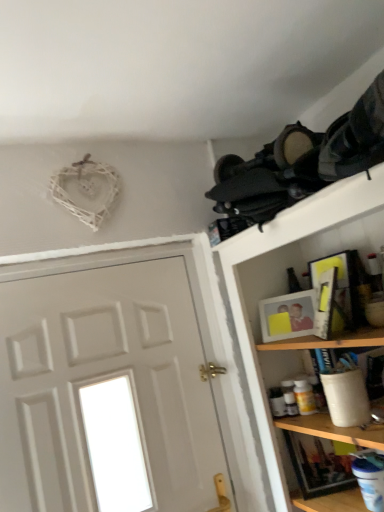
Question: Considering the relative positions of matte yellow picture frame at upper right, the 2th picture frame when ordered from back to front, and wooden shelf at upper right in the image provided, is matte yellow picture frame at upper right, the 2th picture frame when ordered from back to front, to the left of wooden shelf at upper right from the viewer's perspective?

Choices:
 (A) yes
 (B) no

Answer: (A)

Question: Is matte yellow picture frame at upper right, which appears as the 1th picture frame when viewed from the front, wider than wooden shelf at upper right?

Choices:
 (A) yes
 (B) no

Answer: (B)

Question: From the image's perspective, is matte yellow picture frame at upper right, which appears as the 1th picture frame when viewed from the front, over wooden shelf at upper right?

Choices:
 (A) no
 (B) yes

Answer: (B)

Question: Considering the relative sizes of matte yellow picture frame at upper right, which appears as the 1th picture frame when viewed from the front, and wooden shelf at upper right in the image provided, is matte yellow picture frame at upper right, which appears as the 1th picture frame when viewed from the front, bigger than wooden shelf at upper right?

Choices:
 (A) no
 (B) yes

Answer: (A)

Question: From their relative heights in the image, would you say white painted wood door at left is taller or shorter than black fabric backpacks at upper right?

Choices:
 (A) tall
 (B) short

Answer: (A)

Question: Based on their sizes in the image, would you say white painted wood door at left is bigger or smaller than black fabric backpacks at upper right?

Choices:
 (A) big
 (B) small

Answer: (A)

Question: Choose the correct answer: Is white painted wood door at left inside black fabric backpacks at upper right or outside it?

Choices:
 (A) outside
 (B) inside

Answer: (A)

Question: From a real-world perspective, is white painted wood door at left above or below black fabric backpacks at upper right?

Choices:
 (A) below
 (B) above

Answer: (A)

Question: Is white painted wood door at left situated inside matte white picture frame at upper right, the second picture frame viewed from the front, or outside?

Choices:
 (A) inside
 (B) outside

Answer: (B)

Question: From a real-world perspective, is white painted wood door at left physically located above or below matte white picture frame at upper right, the second picture frame viewed from the front?

Choices:
 (A) below
 (B) above

Answer: (A)

Question: Considering their positions, is white painted wood door at left located in front of or behind matte white picture frame at upper right, the first picture frame from the back?

Choices:
 (A) front
 (B) behind

Answer: (A)

Question: In terms of height, does white painted wood door at left look taller or shorter compared to matte white picture frame at upper right, the second picture frame viewed from the front?

Choices:
 (A) tall
 (B) short

Answer: (A)

Question: From their relative heights in the image, would you say matte white picture frame at upper right, the second picture frame viewed from the front, is taller or shorter than white painted wood door at left?

Choices:
 (A) tall
 (B) short

Answer: (B)

Question: Considering their positions, is matte white picture frame at upper right, the first picture frame from the back, located in front of or behind white painted wood door at left?

Choices:
 (A) front
 (B) behind

Answer: (B)